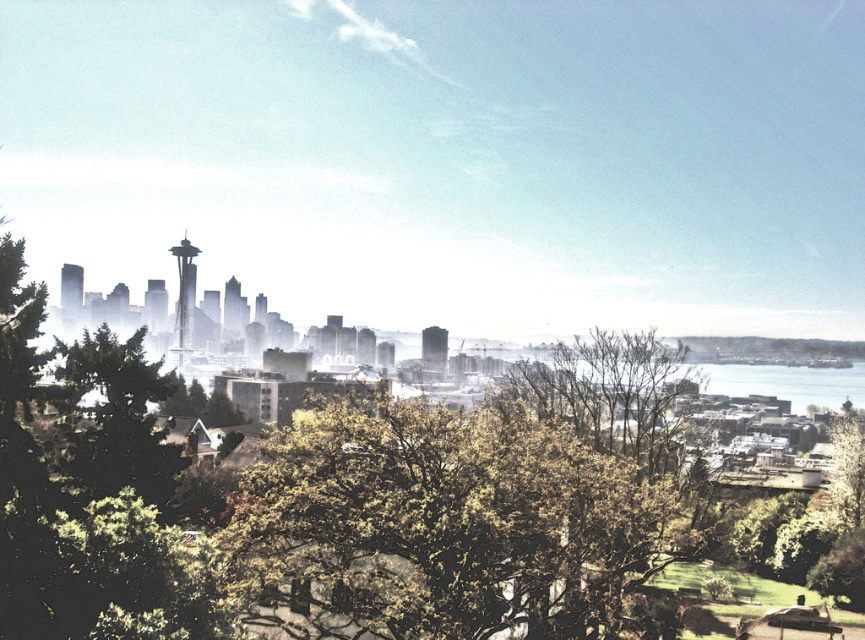
You are standing at the center of the city park and see the green leafy tree at center. If you walk 10 meters north, will you be closer to the Space Needle?

The green leafy tree at center is located at coordinates (445, 529). Since the Space Needle is in the distance behind the city park, walking north away from the park center would take you further away from the Space Needle. Therefore, moving north would not bring you closer to the Space Needle.